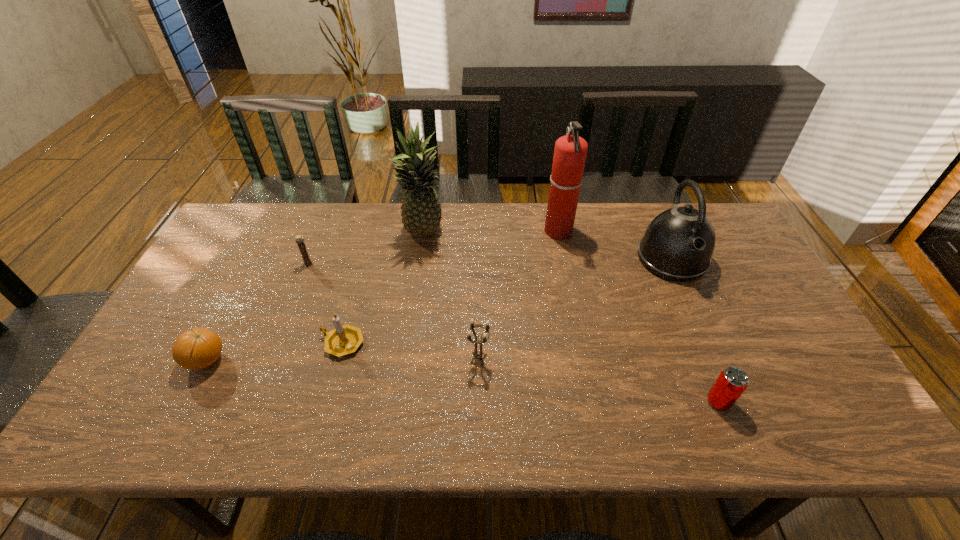
The height and width of the screenshot is (540, 960). I want to click on free space at the far left corner of the desktop, so click(x=257, y=217).

In the image, there is a desktop. In order to click on free region at the near right corner in this screenshot , I will do tap(857, 437).

Find the location of a particular element. This screenshot has width=960, height=540. free space between the rightmost candle holder and the orange is located at coordinates (343, 360).

Where is `free space between the leftmost object and the nearest object`? Image resolution: width=960 pixels, height=540 pixels. free space between the leftmost object and the nearest object is located at coordinates (463, 381).

In order to click on free space between the orange and the kettle in this screenshot , I will do `click(439, 309)`.

The image size is (960, 540). I want to click on free spot between the third tallest object and the leftmost candle holder, so click(x=490, y=261).

Where is `free point between the fourth object from right to left and the farthest candle holder`? free point between the fourth object from right to left and the farthest candle holder is located at coordinates (394, 312).

What are the coordinates of `vacant area between the third object from left to right and the fire extinguisher` in the screenshot? It's located at (450, 287).

The width and height of the screenshot is (960, 540). What are the coordinates of `free space between the rightmost candle holder and the seventh object from right to left` in the screenshot? It's located at (394, 312).

Locate an element on the screen. This screenshot has width=960, height=540. empty space that is in between the farthest candle holder and the fourth object from right to left is located at coordinates 394,312.